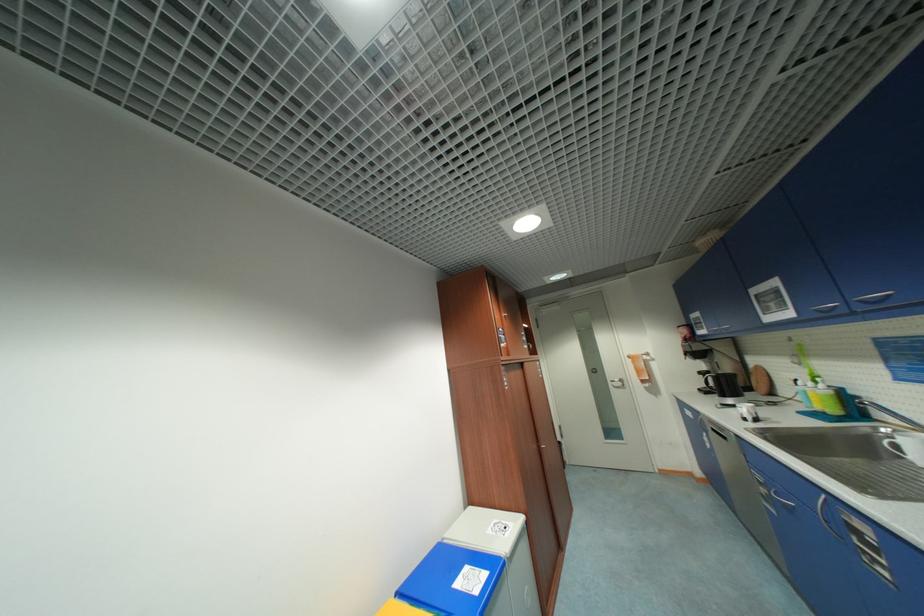
Identify the location of blue bin lid. Image resolution: width=924 pixels, height=616 pixels. (453, 581).